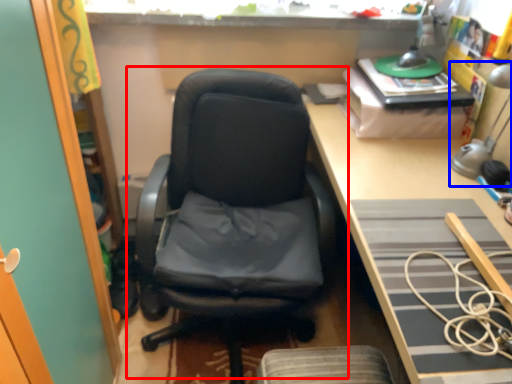
Question: Which object is further to the camera taking this photo, chair (highlighted by a red box) or table lamp (highlighted by a blue box)?

Choices:
 (A) chair
 (B) table lamp

Answer: (B)